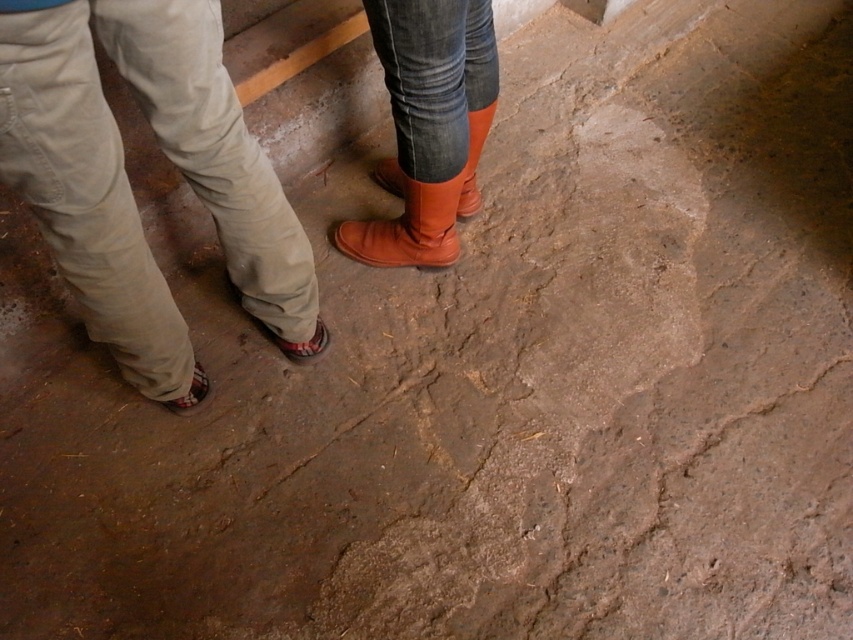
Looking at this image, who is shorter, matte leather boot at center or matte orange boot at center?

With less height is matte leather boot at center.

Does point (461, 173) come closer to viewer compared to point (399, 173)?

Yes.

Where is `matte leather boot at center`? The width and height of the screenshot is (853, 640). matte leather boot at center is located at coordinates (407, 228).

What are the coordinates of `matte leather boot at center` in the screenshot? It's located at (407, 228).

Does brown leather sandal at lower left appear on the right side of leather sandal at lower left?

Yes, brown leather sandal at lower left is to the right of leather sandal at lower left.

Is brown leather sandal at lower left bigger than leather sandal at lower left?

Correct, brown leather sandal at lower left is larger in size than leather sandal at lower left.

This screenshot has height=640, width=853. I want to click on brown leather sandal at lower left, so click(x=303, y=344).

Does matte leather boot at center have a greater width compared to leather sandal at lower left?

Indeed, matte leather boot at center has a greater width compared to leather sandal at lower left.

Does point (363, 234) come closer to viewer compared to point (178, 413)?

No, (363, 234) is behind (178, 413).

What are the coordinates of `matte leather boot at center` in the screenshot? It's located at (407, 228).